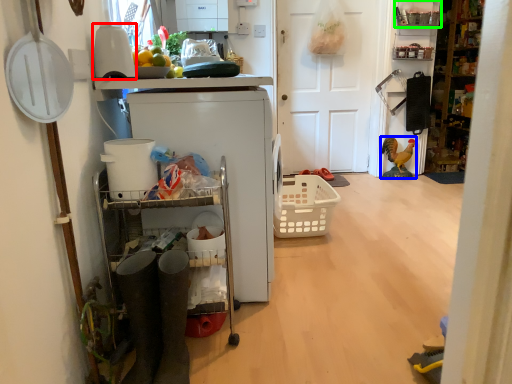
Question: Considering the real-world distances, which object is farthest from appliance (highlighted by a red box)? toy (highlighted by a blue box) or shelf (highlighted by a green box)?

Choices:
 (A) toy
 (B) shelf

Answer: (A)